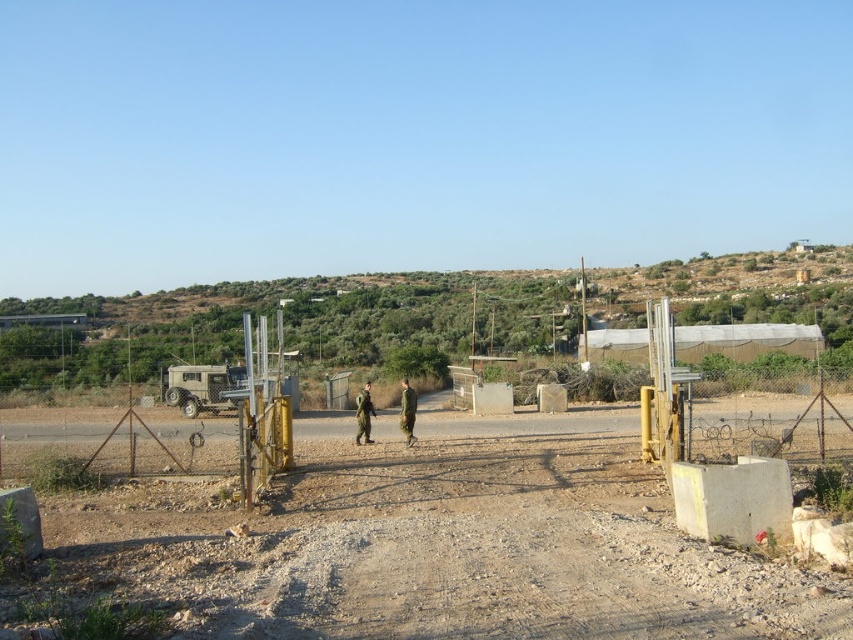
Question: Is green military uniform at center positioned before green matte uniform at center?

Choices:
 (A) yes
 (B) no

Answer: (A)

Question: In this image, where is green military uniform at center located relative to green matte uniform at center?

Choices:
 (A) above
 (B) below

Answer: (B)

Question: Which object is farther from the camera taking this photo?

Choices:
 (A) green military uniform at center
 (B) green matte uniform at center

Answer: (B)

Question: Is green military uniform at center positioned behind green matte uniform at center?

Choices:
 (A) yes
 (B) no

Answer: (B)

Question: Which of the following is the farthest from the observer?

Choices:
 (A) green matte uniform at center
 (B) green military uniform at center

Answer: (A)